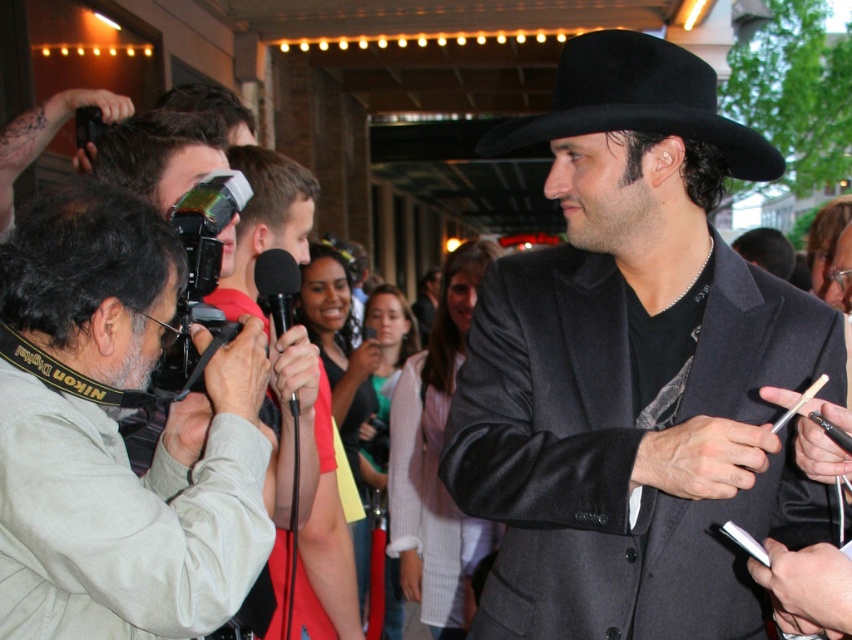
Question: Can you confirm if red shirt at center is positioned to the right of black felt fedora at upper center?

Choices:
 (A) yes
 (B) no

Answer: (B)

Question: Which point is closer to the camera?

Choices:
 (A) black felt fedora at upper center
 (B) shiny black suit at center
 (C) black plastic video camera at left
 (D) gray fabric camera at left

Answer: (D)

Question: Which point is farther from the camera taking this photo?

Choices:
 (A) (182, 381)
 (B) (781, 308)
 (C) (609, 106)

Answer: (A)

Question: Does black felt fedora at upper center appear under black plastic video camera at left?

Choices:
 (A) yes
 (B) no

Answer: (B)

Question: Considering the real-world distances, which object is closest to the black plastic video camera at left?

Choices:
 (A) shiny black suit at center
 (B) gray fabric camera at left
 (C) red shirt at center

Answer: (B)

Question: Can you confirm if red shirt at center is positioned to the left of black felt fedora at upper center?

Choices:
 (A) yes
 (B) no

Answer: (A)